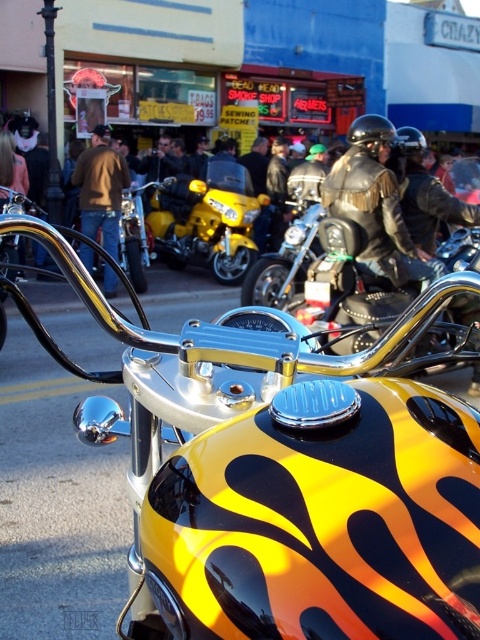
You are a photographer trying to capture both the shiny chrome motorcycle at center and the brown leather jacket at center in a single frame. Since you want both to be clearly visible, which object should you focus on to ensure it doesn t get crowded by the other?

The shiny chrome motorcycle at center occupies less space than the brown leather jacket at center, so you should focus on the brown leather jacket at center to ensure it doesn t get crowded by the motorcycle.

You are a photographer standing in front of the yellow metallic motorcycle at center and the leather jacket at center. You want to take a photo that focuses on the motorcycle while keeping the jacket in the background. Which object should you position closer to the camera to achieve this effect?

To focus on the yellow metallic motorcycle at center while keeping the leather jacket at center in the background, position the yellow metallic motorcycle at center closer to the camera since it is already further to the viewer than the leather jacket at center.